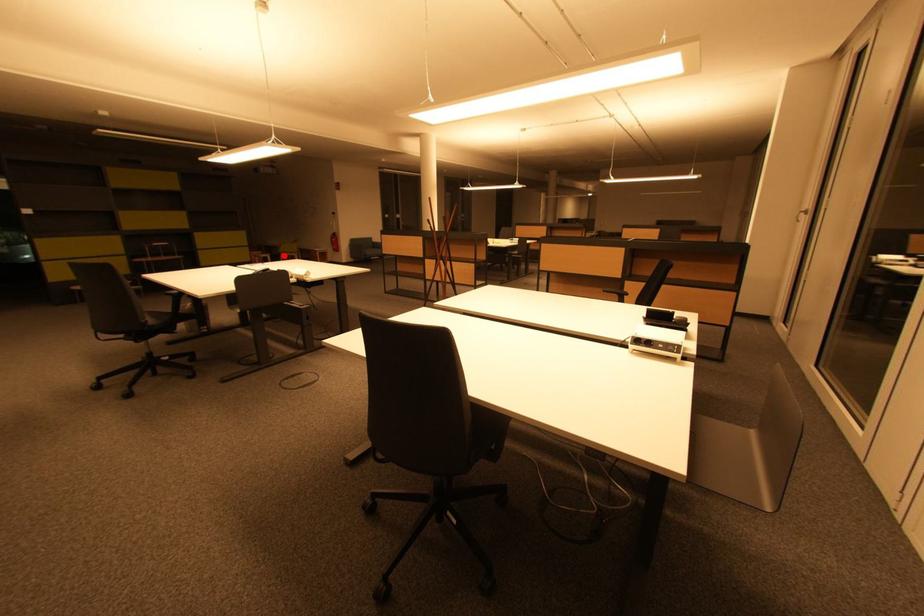
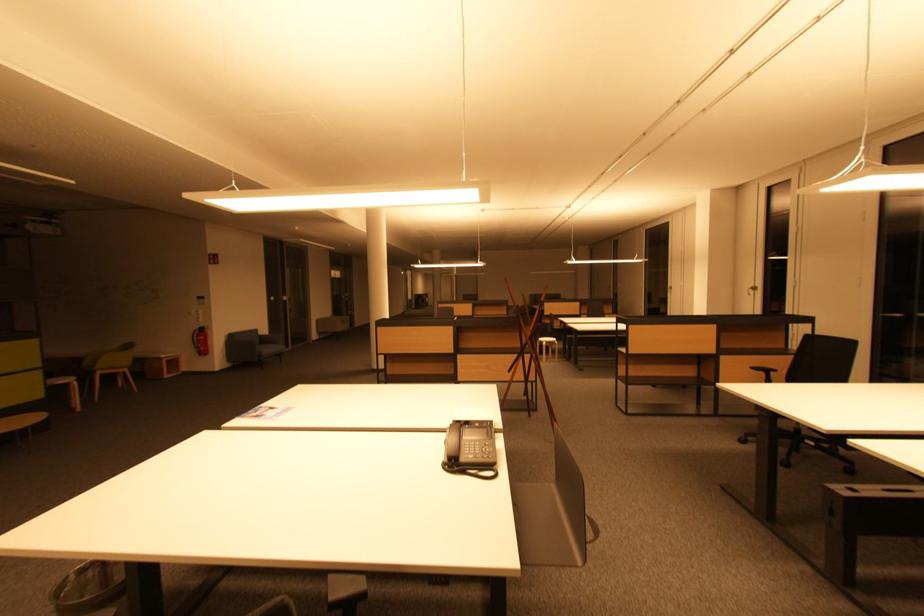
Locate, in the second image, the point that corresponds to the highlighted location in the first image.

(98, 374)